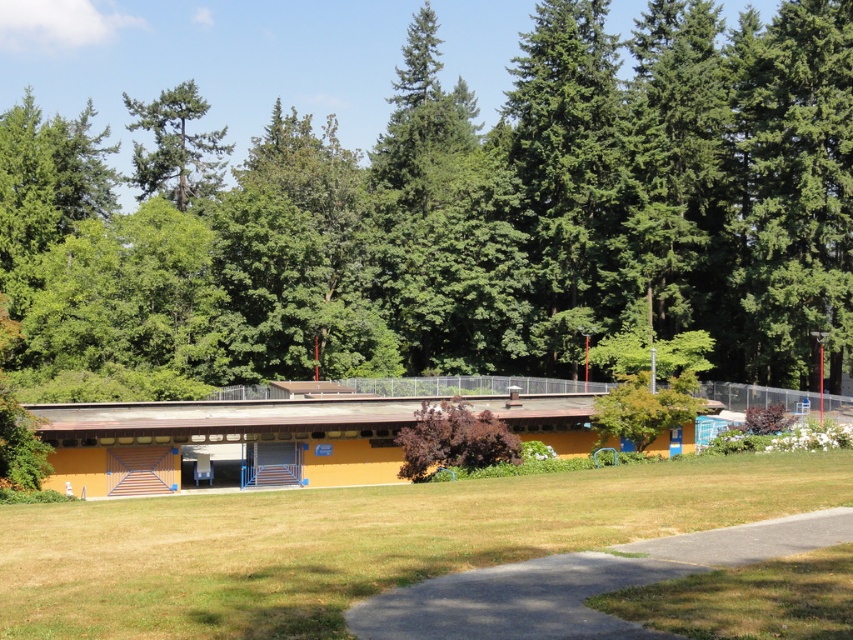
You are planning to plant a new flower bed between the green grass at center and the green matte tree at upper center. Based on their sizes, which area would be more suitable for the flower bed?

The green grass at center is smaller than the green matte tree at upper center, so the flower bed would be more suitable near the green grass at center since it has less coverage and might offer more space for planting.

You are standing at the yellow building with a flat roof and looking out towards the grassy area. There are two points marked on the ground in front of you. The first point is at coordinates point (378, 529) and the second point is at point (195, 179). Which of these two points is closer to your current position?

Point (378, 529) is closer to the camera than point (195, 179), so the first point is closer to your current position.

A maintenance worker needs to mow the green grass at center and water the green matte tree at upper center. If the worker starts at the building, which task should they do first to minimize walking distance?

The worker should water the green matte tree at upper center first because it is farther away from the green grass at center than the building, so starting there reduces backtracking.